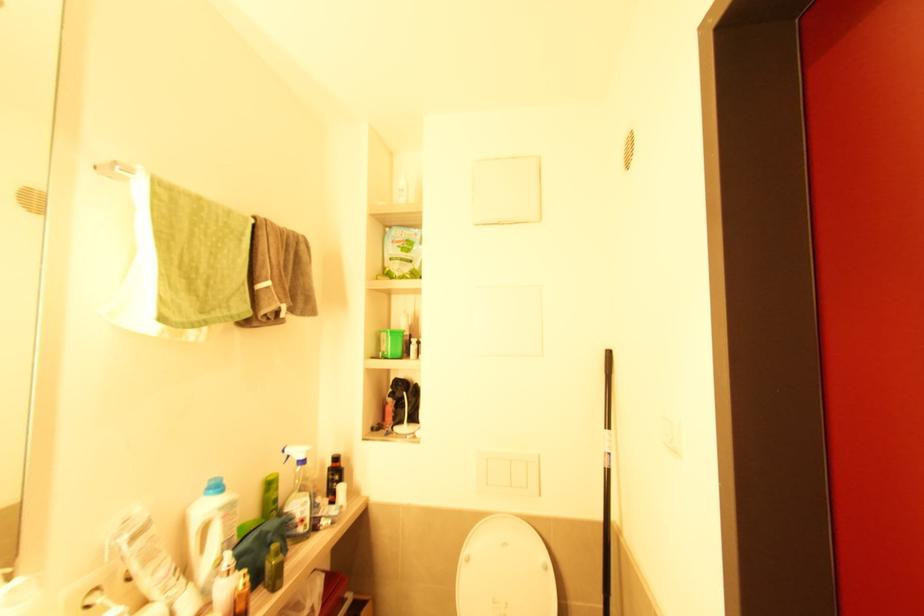
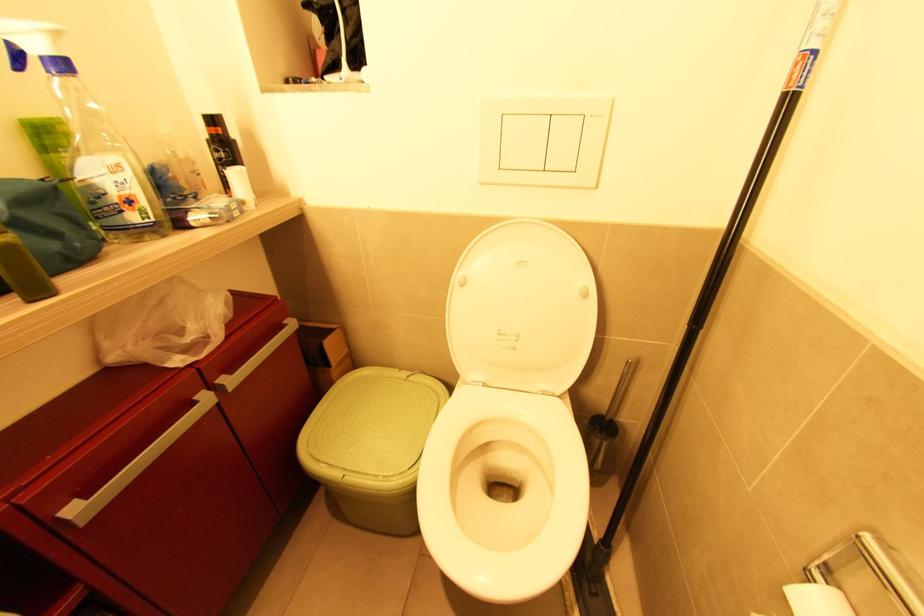
Question: Based on the continuous images, in which direction is the camera rotating? Reply with the corresponding letter.

Choices:
 (A) Left
 (B) Right
 (C) Up
 (D) Down

Answer: (D)